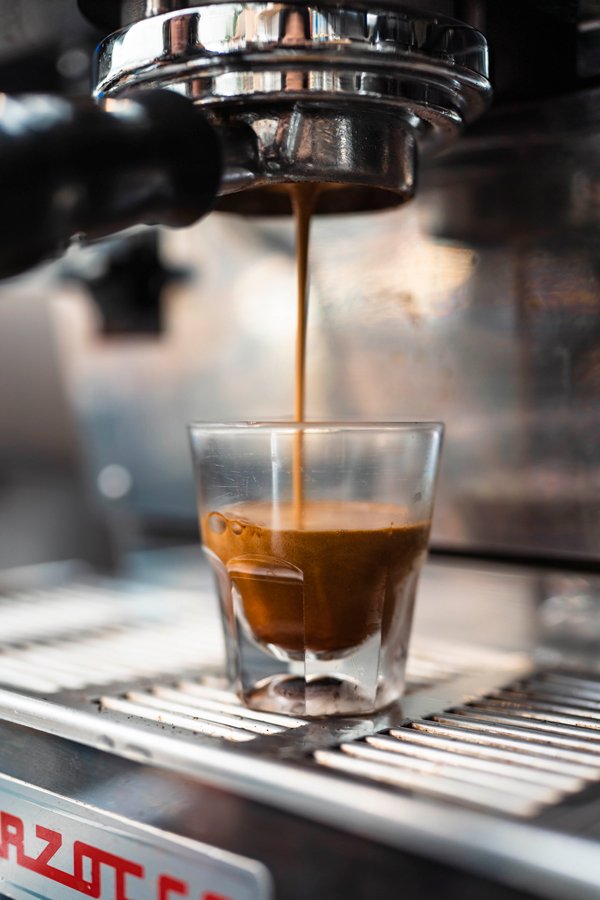
Image resolution: width=600 pixels, height=900 pixels. I want to click on base of glass, so click(x=328, y=715).